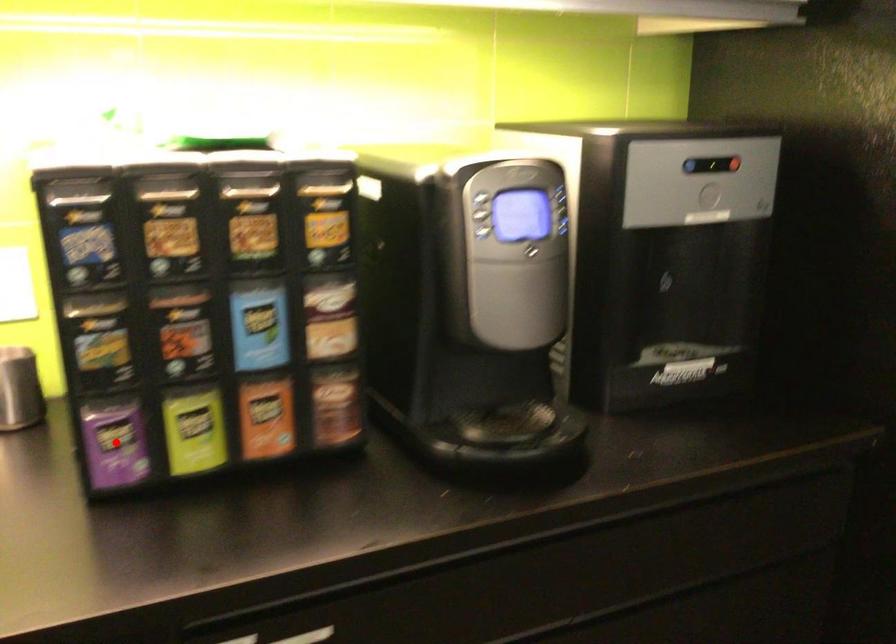
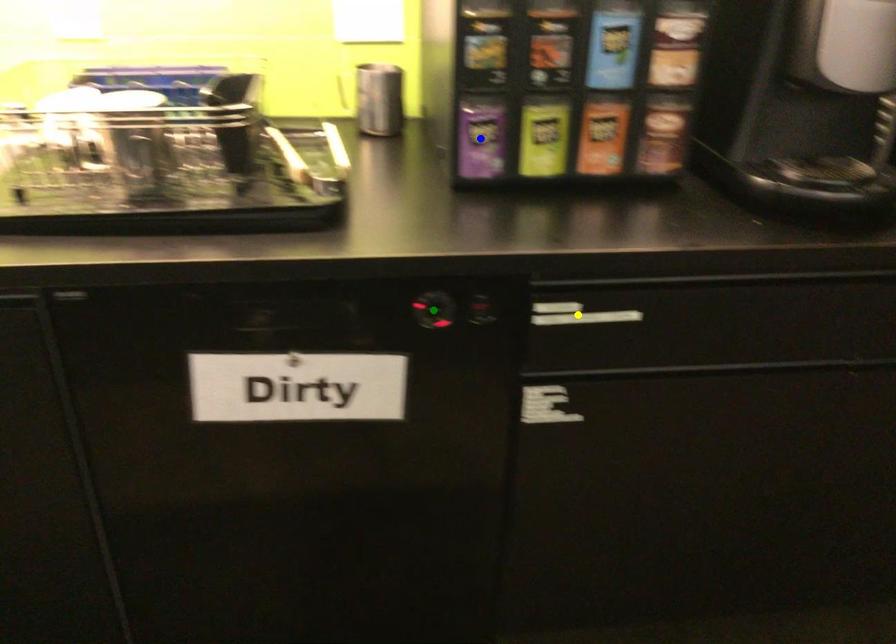
Question: I am providing you with two images of the same scene from different viewpoints. A red point is marked on the first image. You are given multiple points on the second image. Which mark in image 2 goes with the point in image 1?

Choices:
 (A) green point
 (B) blue point
 (C) yellow point

Answer: (B)